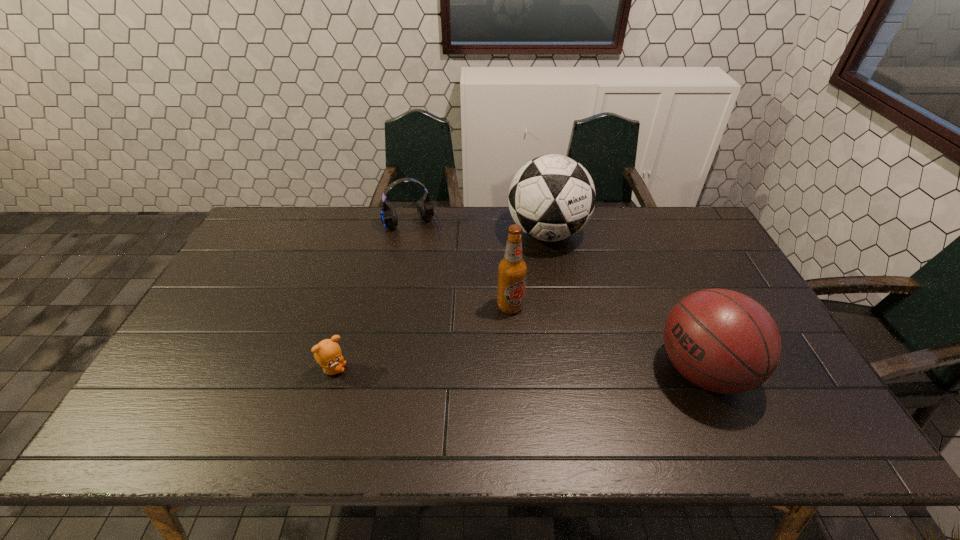
Find the location of a particular element. The height and width of the screenshot is (540, 960). the shortest object is located at coordinates (327, 353).

The image size is (960, 540). Identify the location of basketball. (723, 341).

This screenshot has width=960, height=540. Find the location of `the third tallest object`. the third tallest object is located at coordinates (723, 341).

Where is `beer bottle`? beer bottle is located at coordinates (512, 269).

You are a GUI agent. You are given a task and a screenshot of the screen. Output one action in this format:
    pyautogui.click(x=<x>, y=<y>)
    Task: Click on the fourth tallest object
    The width and height of the screenshot is (960, 540).
    Given the screenshot: What is the action you would take?
    pyautogui.click(x=425, y=209)

You are a GUI agent. You are given a task and a screenshot of the screen. Output one action in this format:
    pyautogui.click(x=<x>, y=<y>)
    Task: Click on the soccer ball
    This screenshot has height=540, width=960.
    Given the screenshot: What is the action you would take?
    pyautogui.click(x=552, y=197)

You are a GUI agent. You are given a task and a screenshot of the screen. Output one action in this format:
    pyautogui.click(x=<x>, y=<y>)
    Task: Click on the vacant space located on the face of the shortest object
    The width and height of the screenshot is (960, 540).
    Given the screenshot: What is the action you would take?
    pyautogui.click(x=366, y=369)

Locate an element on the screen. This screenshot has height=540, width=960. vacant region located 0.210m on the back of the third shortest object is located at coordinates (662, 280).

Find the location of a particular element. The image size is (960, 540). free space located on the front label of the third farthest object is located at coordinates pos(555,384).

At what (x,y) coordinates should I click in order to perform the action: click on vacant position located 0.300m on the front label of the third farthest object. Please return your answer as a coordinate pair (x, y). Looking at the image, I should click on (566, 404).